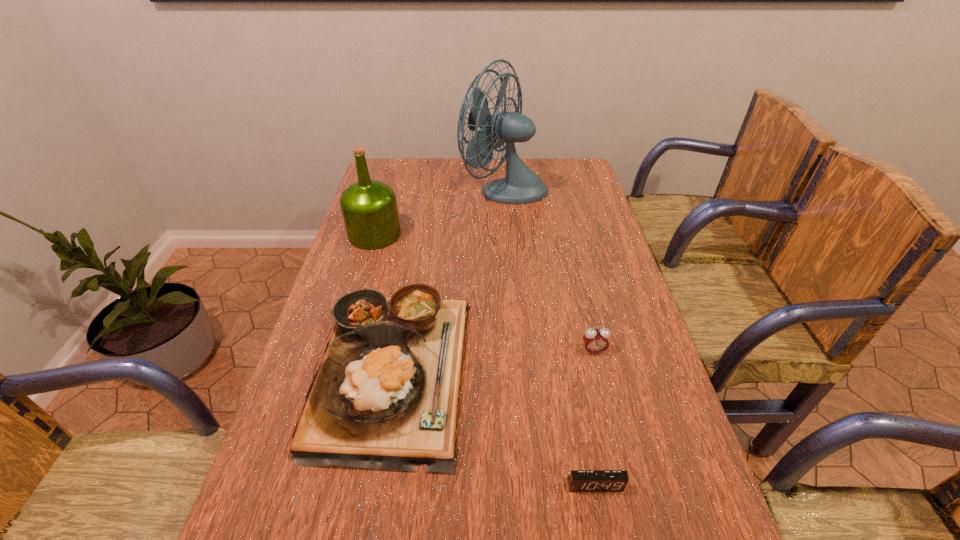
You are a GUI agent. You are given a task and a screenshot of the screen. Output one action in this format:
    pyautogui.click(x=<x>, y=<y>)
    Task: Click on the vacant space at the right edge of the desktop
    
    Given the screenshot: What is the action you would take?
    pyautogui.click(x=587, y=190)

Find the location of `vacant area at the far left corner`. vacant area at the far left corner is located at coordinates (384, 161).

Where is `vacant space that's between the farther alarm clock and the shorter alarm clock`? The image size is (960, 540). vacant space that's between the farther alarm clock and the shorter alarm clock is located at coordinates (594, 418).

You are a GUI agent. You are given a task and a screenshot of the screen. Output one action in this format:
    pyautogui.click(x=<x>, y=<y>)
    Task: Click on the free space between the farthest object and the platter
    The image size is (960, 540).
    Given the screenshot: What is the action you would take?
    pyautogui.click(x=448, y=279)

Where is `vacant area that lies between the platter and the farthest object`? The width and height of the screenshot is (960, 540). vacant area that lies between the platter and the farthest object is located at coordinates (448, 279).

In order to click on free space between the platter and the nearest object in this screenshot , I will do `click(493, 427)`.

Find the location of a particular element. vacant point located between the farthest object and the platter is located at coordinates (448, 279).

The width and height of the screenshot is (960, 540). I want to click on unoccupied area between the fourth nearest object and the taller alarm clock, so click(x=484, y=293).

Identify which object is the fourth closest to the platter. Please provide its 2D coordinates. Your answer should be formatted as a tuple, i.e. [(x, y)], where the tuple contains the x and y coordinates of a point satisfying the conditions above.

[(521, 185)]

Where is `object that is the closest to the shorter alarm clock`? The width and height of the screenshot is (960, 540). object that is the closest to the shorter alarm clock is located at coordinates (385, 396).